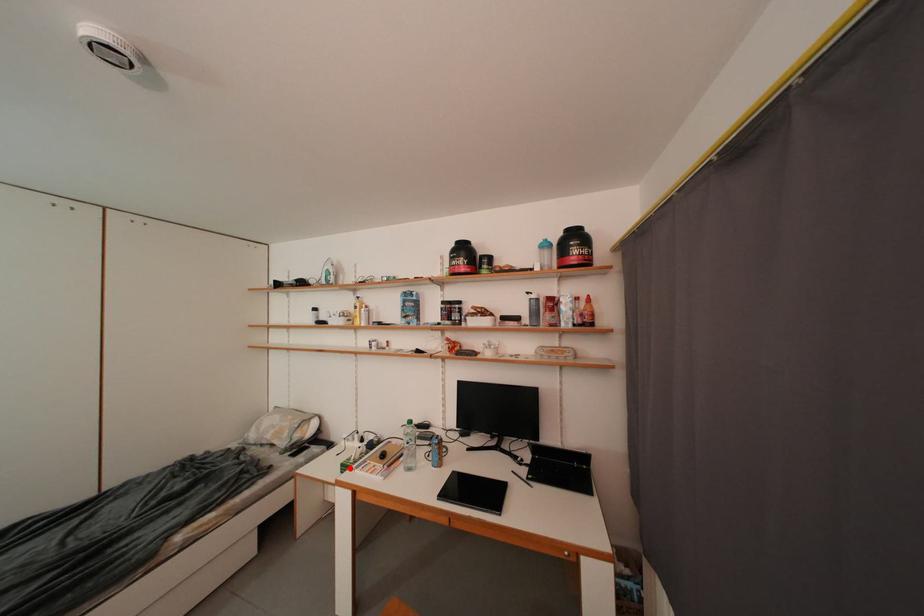
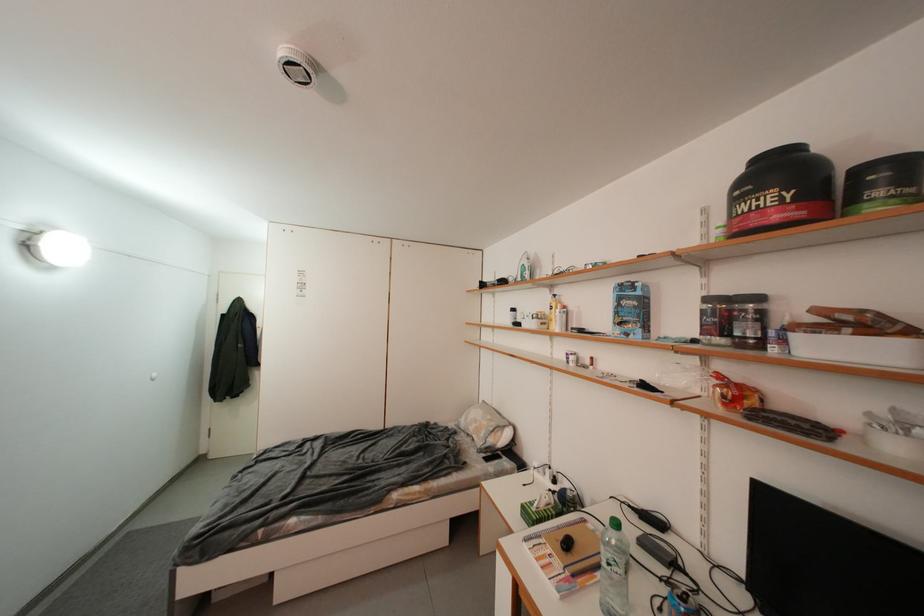
Question: I am providing you with two images of the same scene from different viewpoints. A red point is shown in image1. For the corresponding object point in image2, is it positioned nearer or farther from the camera?

Choices:
 (A) Nearer
 (B) Farther

Answer: (A)